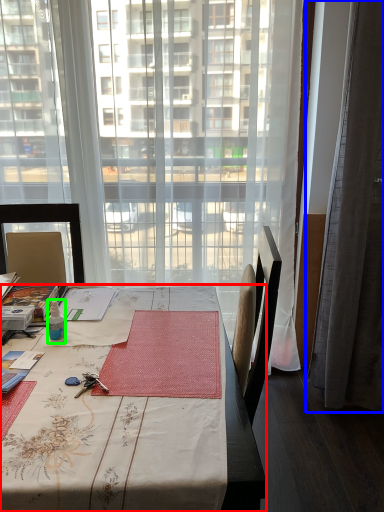
Question: Which object is the closest to the desk (highlighted by a red box)? Choose among these: curtain (highlighted by a blue box) or bottle (highlighted by a green box).

Choices:
 (A) curtain
 (B) bottle

Answer: (B)